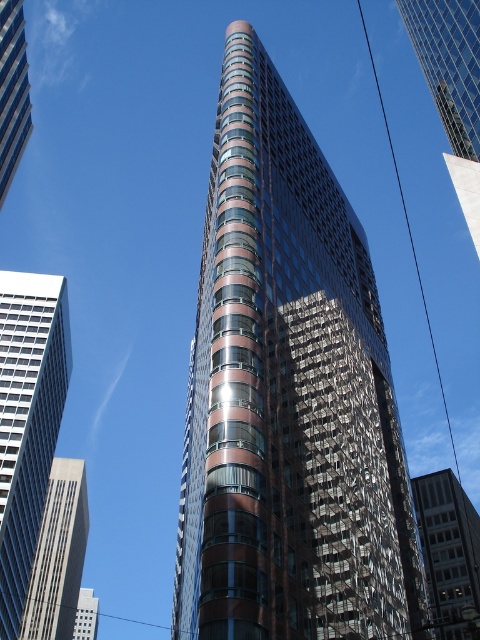
You are standing in front of the white glass skyscraper at left. You notice a point marked at coordinates (27, 420). Based on the description, can you determine where this point is located on the building?

The point at coordinates (27, 420) is on the white glass skyscraper at left.

You are standing at the base of the skyscraper and looking up. There are two points marked on the building. The first point is located at coordinates point (9, 410) and the second at point (451, 97). Which point is closer to your line of sight when you look straight ahead?

Point (451, 97) is closer to your line of sight because it is in front of point (9, 410) according to their spatial arrangement.

You are an architect analyzing two skyscrapers in the image. The gray concrete skyscraper at left and the matte glass skyscraper at left. Which one is located more to the left side?

The gray concrete skyscraper at left is positioned on the left side of the matte glass skyscraper at left, so it is more to the left.